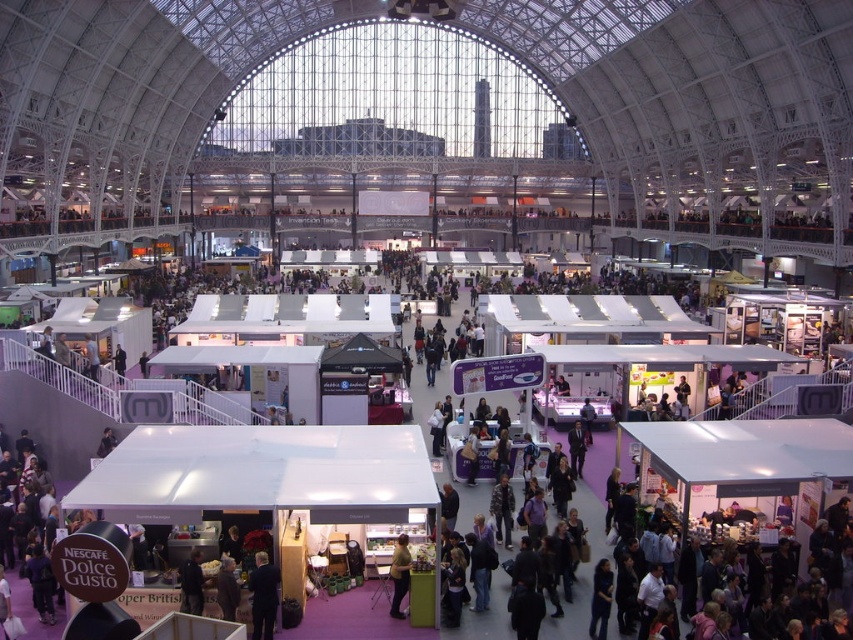
Question: Among these objects, which one is nearest to the camera?

Choices:
 (A) dark blue suit at lower center
 (B) matte yellow shirt at center

Answer: (A)

Question: Which of the following is the closest to the observer?

Choices:
 (A) dark blue suit at lower center
 (B) matte yellow shirt at center

Answer: (A)

Question: Which object appears farthest from the camera in this image?

Choices:
 (A) matte yellow shirt at center
 (B) dark blue suit at lower center

Answer: (A)

Question: Does dark blue suit at lower center appear under matte yellow shirt at center?

Choices:
 (A) yes
 (B) no

Answer: (A)

Question: Is dark blue suit at lower center thinner than matte yellow shirt at center?

Choices:
 (A) no
 (B) yes

Answer: (A)

Question: Can you confirm if dark blue suit at lower center is positioned below matte yellow shirt at center?

Choices:
 (A) no
 (B) yes

Answer: (B)